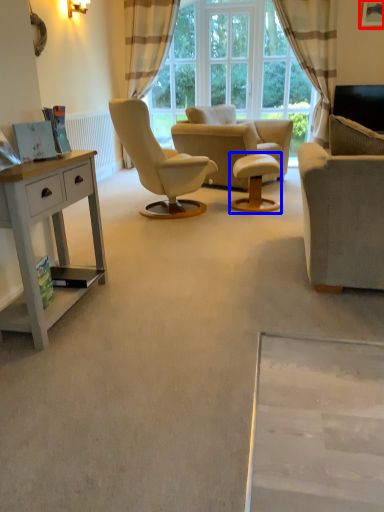
Question: Which of the following is the closest to the observer, picture frame (highlighted by a red box) or round table (highlighted by a blue box)?

Choices:
 (A) picture frame
 (B) round table

Answer: (B)